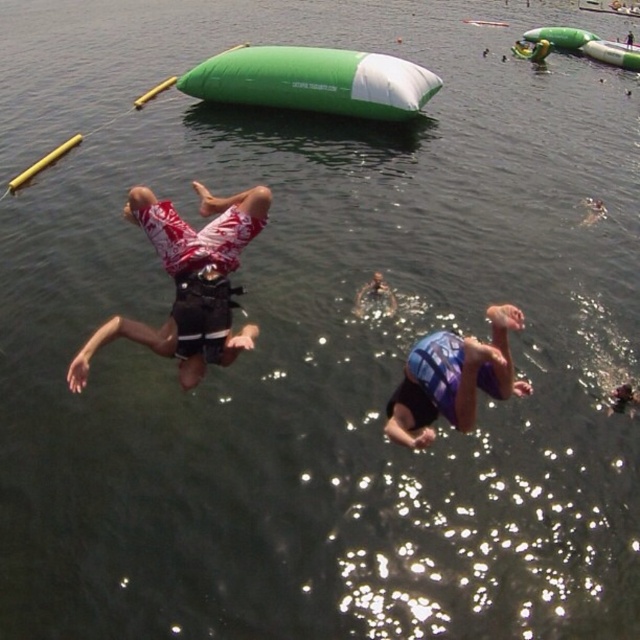
Question: Among these points, which one is nearest to the camera?

Choices:
 (A) (387, 298)
 (B) (416, 381)
 (C) (205, 364)

Answer: (C)

Question: Is printed cotton shorts at center below blue textured life vest at center?

Choices:
 (A) no
 (B) yes

Answer: (B)

Question: Which object is positioned closest to the printed cotton shorts at center?

Choices:
 (A) blue textured life vest at center
 (B) blue mesh swimsuit at center

Answer: (B)

Question: Is blue mesh swimsuit at center positioned behind blue textured life vest at center?

Choices:
 (A) yes
 (B) no

Answer: (B)

Question: Which of the following is the closest to the observer?

Choices:
 (A) (211, 205)
 (B) (508, 312)

Answer: (B)

Question: Is blue mesh swimsuit at center above blue textured life vest at center?

Choices:
 (A) yes
 (B) no

Answer: (B)